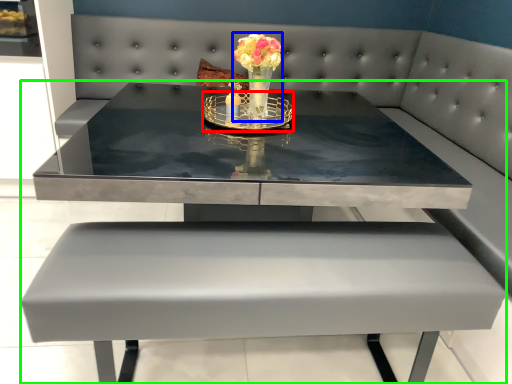
Question: Estimate the real-world distances between objects in this image. Which object is closer to candle holder (highlighted by a red box), floral arrangement (highlighted by a blue box) or table (highlighted by a green box)?

Choices:
 (A) floral arrangement
 (B) table

Answer: (A)